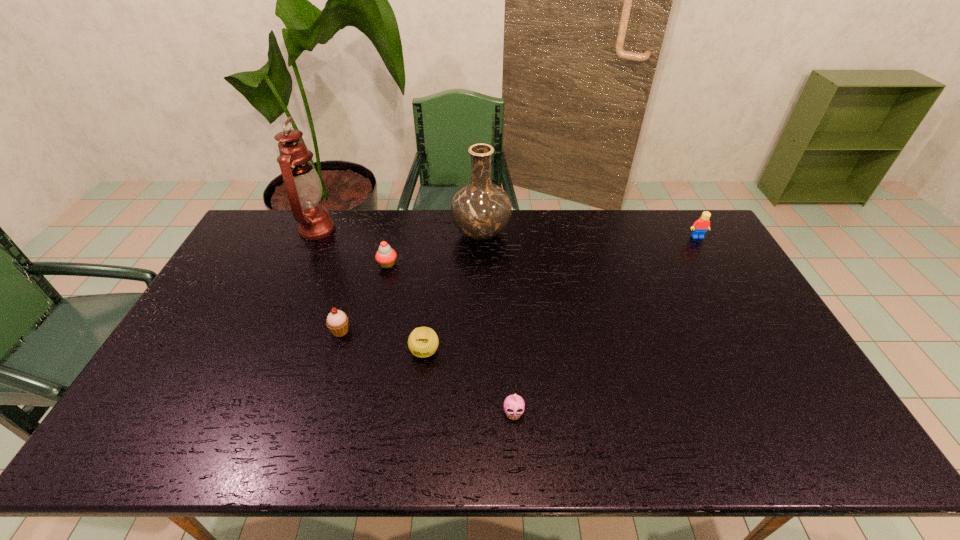
The image size is (960, 540). Find the location of `vacant region between the sixth shortest object and the nearest cupcake`. vacant region between the sixth shortest object and the nearest cupcake is located at coordinates (497, 323).

Identify the location of empty space between the fourth object from right to left and the rightmost object. The height and width of the screenshot is (540, 960). (561, 294).

At what (x,y) coordinates should I click in order to perform the action: click on free spot between the tallest object and the third nearest object. Please return your answer as a coordinate pair (x, y). The width and height of the screenshot is (960, 540). Looking at the image, I should click on (328, 280).

I want to click on unoccupied position between the vase and the sixth farthest object, so click(x=453, y=293).

This screenshot has height=540, width=960. I want to click on vacant space in between the leftmost object and the rightmost object, so click(507, 233).

Locate an element on the screen. vacant space that's between the vase and the Lego is located at coordinates (589, 235).

Locate an element on the screen. free space between the rightmost cupcake and the sixth farthest object is located at coordinates (469, 382).

You are a GUI agent. You are given a task and a screenshot of the screen. Output one action in this format:
    pyautogui.click(x=<x>, y=<y>)
    Task: Click on the vacant area that lies between the oil lamp and the sixth shortest object
    Image resolution: width=960 pixels, height=540 pixels.
    Given the screenshot: What is the action you would take?
    pyautogui.click(x=399, y=231)

Where is `free space between the fourth object from right to left and the second nearest cupcake`? free space between the fourth object from right to left and the second nearest cupcake is located at coordinates (382, 341).

This screenshot has width=960, height=540. In order to click on the third closest object to the nearest object in this screenshot , I will do `click(481, 210)`.